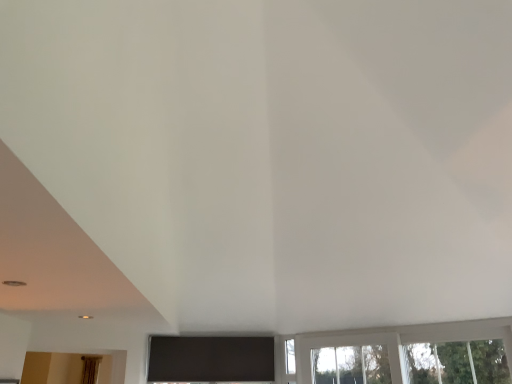
This screenshot has height=384, width=512. What are the coordinates of `transparent glass window at lower right` in the screenshot? It's located at (408, 354).

What do you see at coordinates (408, 354) in the screenshot?
I see `transparent glass window at lower right` at bounding box center [408, 354].

I want to click on brown fabric curtain at lower left, so click(90, 369).

Describe the element at coordinates (90, 369) in the screenshot. This screenshot has width=512, height=384. I see `brown fabric curtain at lower left` at that location.

Locate an element on the screen. transparent glass window at lower right is located at coordinates (408, 354).

Would you say brown fabric curtain at lower left is to the left or to the right of transparent glass window at lower right in the picture?

brown fabric curtain at lower left is to the left of transparent glass window at lower right.

Relative to transparent glass window at lower right, is brown fabric curtain at lower left in front or behind?

brown fabric curtain at lower left is positioned farther from the viewer than transparent glass window at lower right.

Is point (96, 366) farther from camera compared to point (345, 353)?

That is False.

From the image's perspective, is brown fabric curtain at lower left located above or below transparent glass window at lower right?

brown fabric curtain at lower left is situated lower than transparent glass window at lower right in the image.

From a real-world perspective, who is located higher, brown fabric curtain at lower left or transparent glass window at lower right?

transparent glass window at lower right.

Between brown fabric curtain at lower left and transparent glass window at lower right, which one has larger width?

brown fabric curtain at lower left is wider.

Can you confirm if brown fabric curtain at lower left is taller than transparent glass window at lower right?

Yes.

Who is smaller, brown fabric curtain at lower left or transparent glass window at lower right?

brown fabric curtain at lower left is smaller.

Is brown fabric curtain at lower left situated inside transparent glass window at lower right or outside?

brown fabric curtain at lower left exists outside the volume of transparent glass window at lower right.

Is brown fabric curtain at lower left in contact with transparent glass window at lower right?

No, brown fabric curtain at lower left is not beside transparent glass window at lower right.

Is brown fabric curtain at lower left facing away from transparent glass window at lower right?

brown fabric curtain at lower left is not turned away from transparent glass window at lower right.

The width and height of the screenshot is (512, 384). Identify the location of curtain on the left of transparent glass window at lower right. (90, 369).

Considering the relative positions of transparent glass window at lower right and brown fabric curtain at lower left in the image provided, is transparent glass window at lower right to the left or to the right of brown fabric curtain at lower left?

Based on their positions, transparent glass window at lower right is located to the right of brown fabric curtain at lower left.

Which is behind, transparent glass window at lower right or brown fabric curtain at lower left?

brown fabric curtain at lower left.

Is point (492, 337) less distant than point (96, 377)?

Yes, point (492, 337) is in front of point (96, 377).

From the image's perspective, does transparent glass window at lower right appear lower than brown fabric curtain at lower left?

No, from the image's perspective, transparent glass window at lower right is not beneath brown fabric curtain at lower left.

From a real-world perspective, is transparent glass window at lower right below brown fabric curtain at lower left?

Actually, transparent glass window at lower right is physically above brown fabric curtain at lower left in the real world.

Does transparent glass window at lower right have a greater width compared to brown fabric curtain at lower left?

In fact, transparent glass window at lower right might be narrower than brown fabric curtain at lower left.

In the scene shown: Which of these two, transparent glass window at lower right or brown fabric curtain at lower left, stands taller?

brown fabric curtain at lower left is taller.

Considering the sizes of objects transparent glass window at lower right and brown fabric curtain at lower left in the image provided, who is bigger, transparent glass window at lower right or brown fabric curtain at lower left?

transparent glass window at lower right.

Is brown fabric curtain at lower left completely or partially inside transparent glass window at lower right?

No, brown fabric curtain at lower left is not inside transparent glass window at lower right.

Are transparent glass window at lower right and brown fabric curtain at lower left making contact?

No.

Is transparent glass window at lower right positioned with its back to brown fabric curtain at lower left?

That's not correct — transparent glass window at lower right is not looking away from brown fabric curtain at lower left.

Identify the location of window positioned vertically above the brown fabric curtain at lower left (from a real-world perspective). (408, 354).

Where is `window that appears on the right of brown fabric curtain at lower left`? window that appears on the right of brown fabric curtain at lower left is located at coordinates (408, 354).

Locate an element on the screen. window lying in front of the brown fabric curtain at lower left is located at coordinates (408, 354).